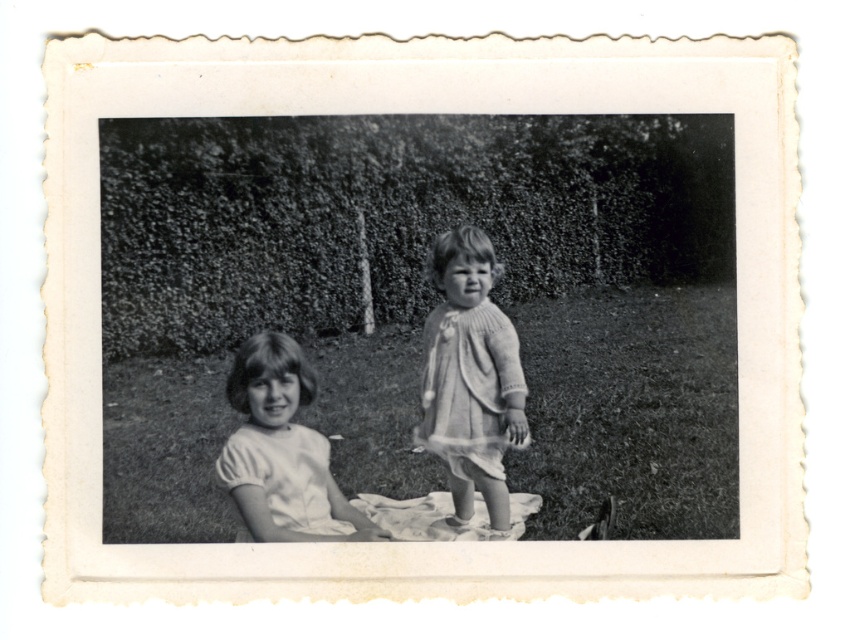
You are planning to lay out a picnic blanket in the scene. Given the grassy lawn at center and the white cotton shirt at left, which area has enough space to accommodate a standard picnic blanket that requires 2 meters in width?

The grassy lawn at center has a larger width than the white cotton shirt at left, so the grassy lawn at center can accommodate the picnic blanket.